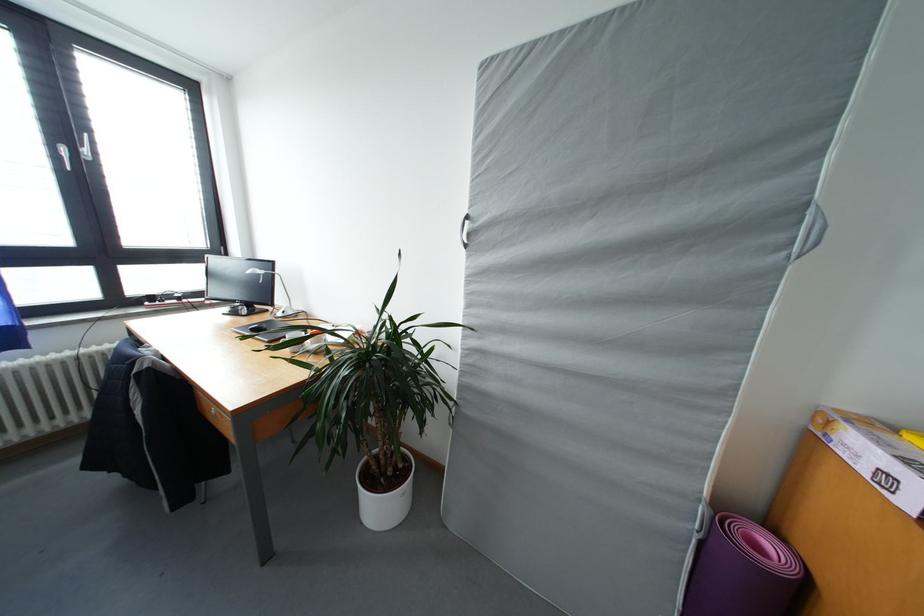
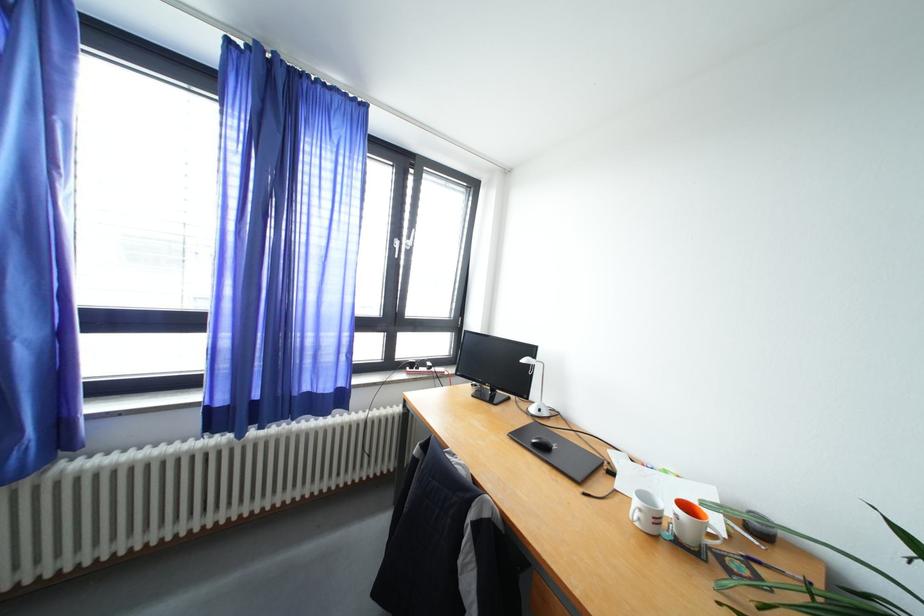
Find the pixel in the second image that matches the point at 157,302 in the first image.

(419, 370)